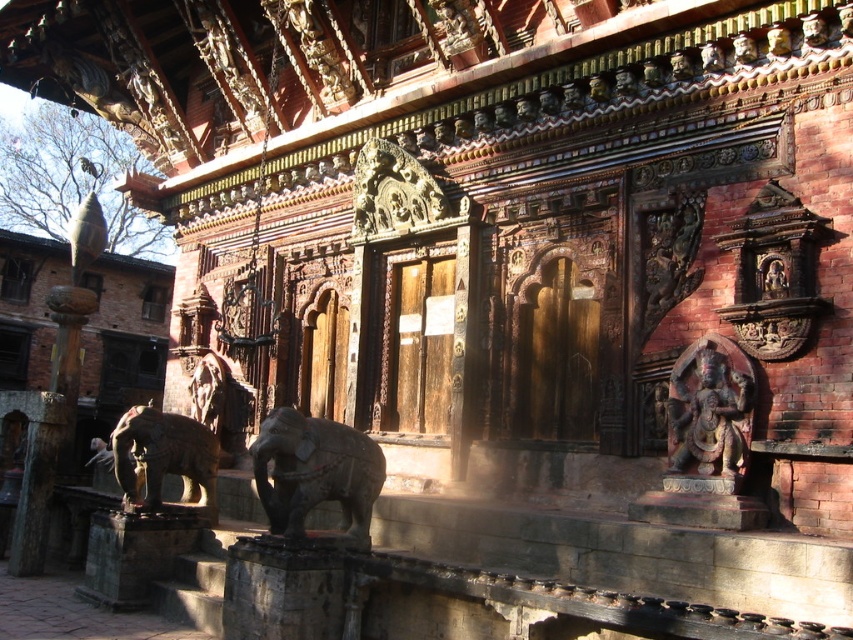
Is point (344, 492) positioned after point (366, 170)?

That is False.

Is the position of polished stone elephant at center less distant than that of carved wood statue at center?

Yes, it is.

Identify the location of polished stone elephant at center. The width and height of the screenshot is (853, 640). (315, 472).

Does polished red stone statue at right have a larger size compared to carved wood statue at center?

Incorrect, polished red stone statue at right is not larger than carved wood statue at center.

Can you confirm if polished red stone statue at right is wider than carved wood statue at center?

In fact, polished red stone statue at right might be narrower than carved wood statue at center.

Locate an element on the screen. This screenshot has height=640, width=853. polished red stone statue at right is located at coordinates (711, 408).

The height and width of the screenshot is (640, 853). Identify the location of polished red stone statue at right. (711, 408).

Which is above, polished stone elephant at center or polished red stone statue at right?

Positioned higher is polished red stone statue at right.

Does point (368, 461) lie in front of point (715, 336)?

Yes, it is.

Does point (276, 506) lie in front of point (734, 429)?

No, it is behind (734, 429).

In order to click on polished stone elephant at center in this screenshot , I will do `click(315, 472)`.